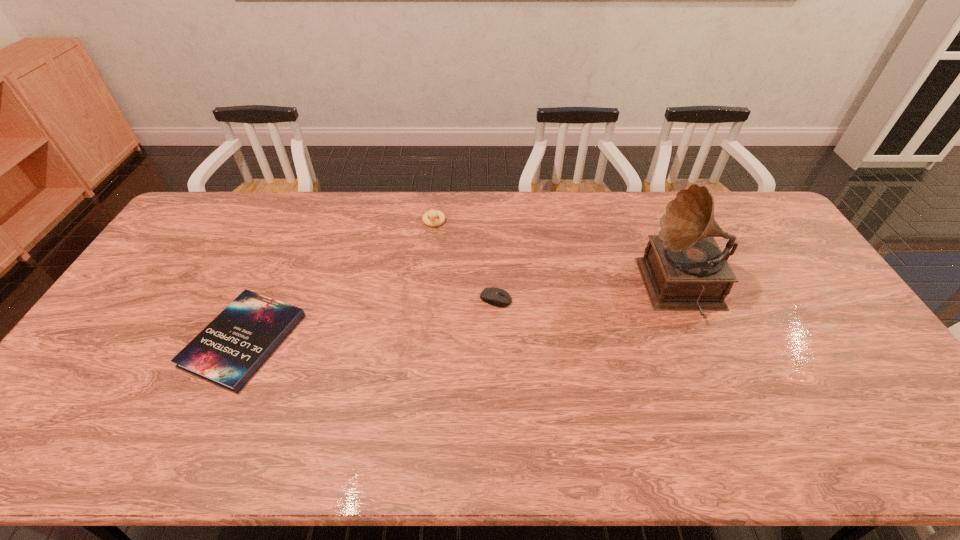
In order to click on vacant area situated at the beak of the duckling in this screenshot , I will do (426, 289).

This screenshot has height=540, width=960. Identify the location of vacant space located on the right of the third object from left to right. (545, 299).

At what (x,y) coordinates should I click in order to perform the action: click on vacant space located 0.100m on the back of the hardback book. Please return your answer as a coordinate pair (x, y). The height and width of the screenshot is (540, 960). Looking at the image, I should click on click(275, 272).

The image size is (960, 540). Find the location of `object situated at the far edge`. object situated at the far edge is located at coordinates (432, 214).

Where is `free region at the far edge`? The height and width of the screenshot is (540, 960). free region at the far edge is located at coordinates pos(422,210).

Identify the location of vacant space at the near edge. The width and height of the screenshot is (960, 540). (750, 452).

The height and width of the screenshot is (540, 960). What are the coordinates of `free location at the left edge of the desktop` in the screenshot? It's located at (181, 284).

The height and width of the screenshot is (540, 960). In the image, there is a desktop. What are the coordinates of `free space at the right edge` in the screenshot? It's located at (868, 383).

Identify the location of vacant point located between the tallest object and the third object from left to right. This screenshot has width=960, height=540. (589, 294).

Image resolution: width=960 pixels, height=540 pixels. I want to click on free space between the hardback book and the tallest object, so click(x=464, y=314).